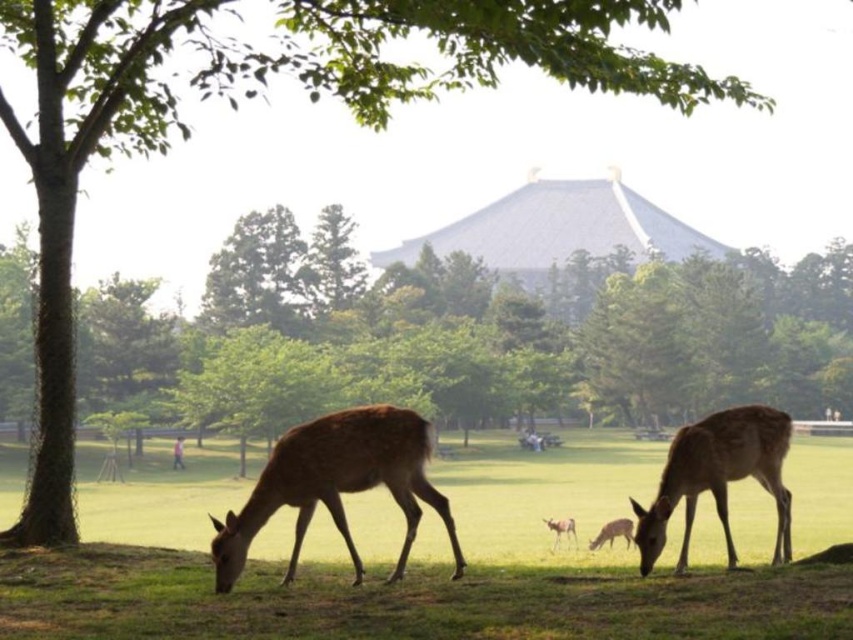
Question: Which point appears farthest from the camera in this image?

Choices:
 (A) (64, 582)
 (B) (601, 545)

Answer: (B)

Question: Estimate the real-world distances between objects in this image. Which object is closer to the green grassy at lower center?

Choices:
 (A) brown velvet deer at center
 (B) brown velvet deer at lower center
 (C) brown velvet deer at lower right
 (D) brown matte/deer at lower left

Answer: (A)

Question: Which object is positioned farthest from the brown velvet deer at lower right?

Choices:
 (A) brown velvet deer at center
 (B) brown velvet deer at lower center
 (C) brown matte/deer at lower left

Answer: (A)

Question: Does green grassy at lower center have a larger size compared to brown matte/deer at lower left?

Choices:
 (A) no
 (B) yes

Answer: (B)

Question: Is brown velvet deer at lower right above brown velvet deer at center?

Choices:
 (A) yes
 (B) no

Answer: (A)

Question: Does brown velvet deer at lower center come in front of brown velvet deer at center?

Choices:
 (A) yes
 (B) no

Answer: (A)